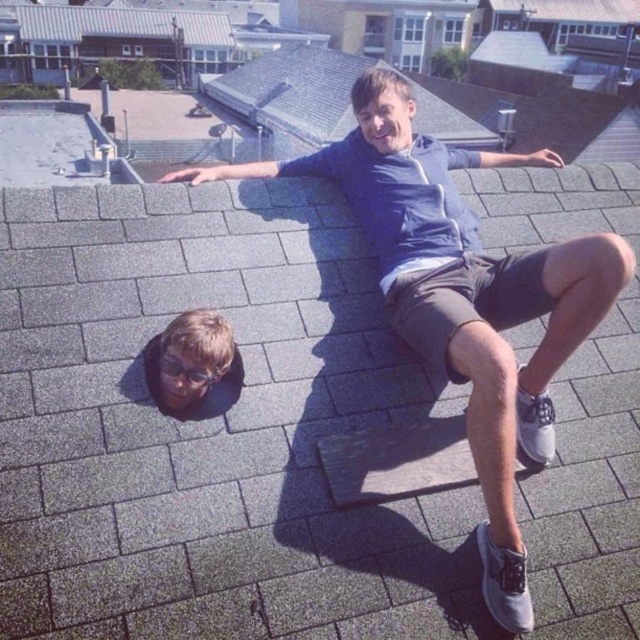
Image resolution: width=640 pixels, height=640 pixels. What are the coordinates of `matte blue hoodie at upper center` in the screenshot? It's located at pyautogui.click(x=461, y=296).

Does matte blue hoodie at upper center have a lesser height compared to blonde hair at lower left?

In fact, matte blue hoodie at upper center may be taller than blonde hair at lower left.

Is point (232, 166) behind point (216, 317)?

Yes, point (232, 166) is farther from viewer.

You are a GUI agent. You are given a task and a screenshot of the screen. Output one action in this format:
    pyautogui.click(x=<x>, y=<y>)
    Task: Click on the matte blue hoodie at upper center
    This screenshot has height=640, width=640.
    Given the screenshot: What is the action you would take?
    pyautogui.click(x=461, y=296)